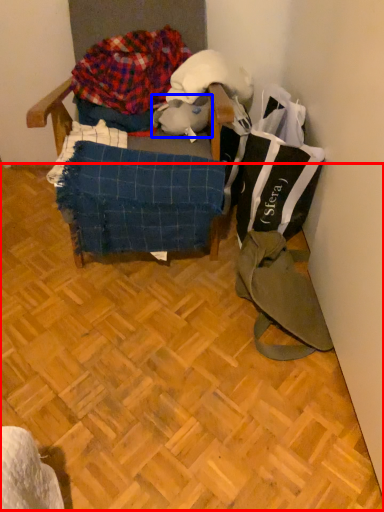
Question: Which object appears closest to the camera in this image, wood (highlighted by a red box) or animal (highlighted by a blue box)?

Choices:
 (A) wood
 (B) animal

Answer: (A)